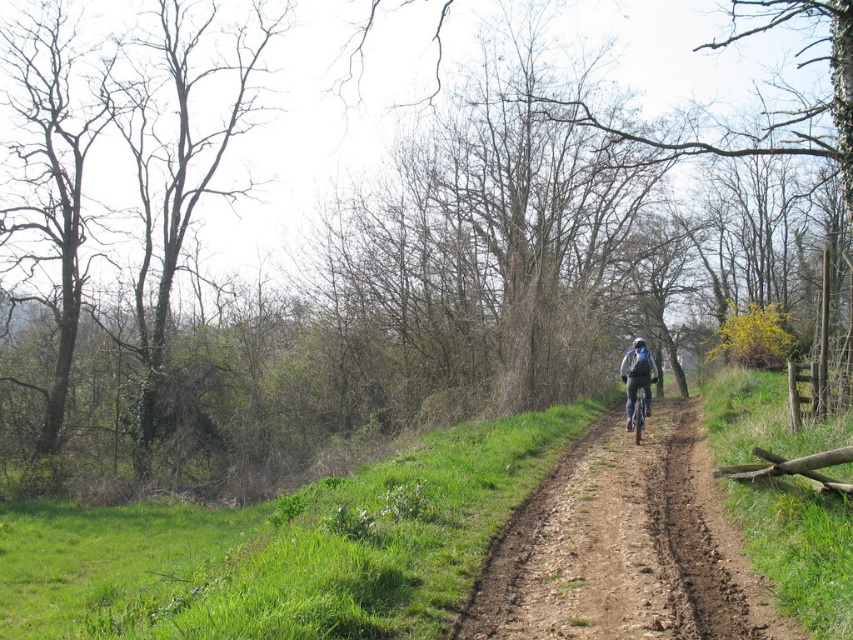
Question: Can you confirm if matte black bicycle at center is bigger than shiny metallic bicycle at center-right?

Choices:
 (A) no
 (B) yes

Answer: (B)

Question: Does brown dirt track at center appear on the left side of matte black bicycle at center?

Choices:
 (A) yes
 (B) no

Answer: (A)

Question: Based on their relative distances, which object is nearer to the brown dirt track at center?

Choices:
 (A) matte black bicycle at center
 (B) shiny metallic bicycle at center-right

Answer: (B)

Question: Which object is the farthest from the matte black bicycle at center?

Choices:
 (A) brown dirt track at center
 (B) shiny metallic bicycle at center-right

Answer: (A)

Question: Which of the following is the closest to the observer?

Choices:
 (A) shiny metallic bicycle at center-right
 (B) matte black bicycle at center
 (C) brown dirt track at center

Answer: (C)

Question: Is matte black bicycle at center smaller than shiny metallic bicycle at center-right?

Choices:
 (A) no
 (B) yes

Answer: (A)